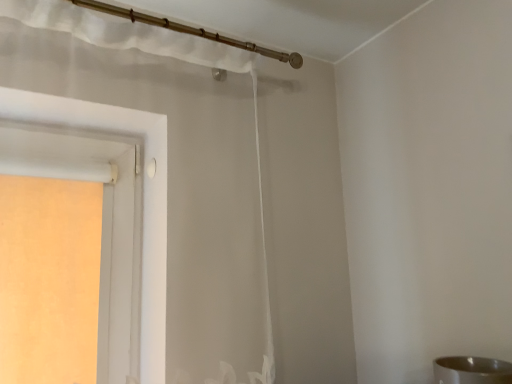
Locate an element on the screen. silver metallic sink at lower right is located at coordinates (471, 370).

The width and height of the screenshot is (512, 384). What do you see at coordinates (471, 370) in the screenshot? I see `silver metallic sink at lower right` at bounding box center [471, 370].

Find the location of a particular element. This screenshot has height=384, width=512. sheer white curtain at upper center is located at coordinates (140, 33).

The width and height of the screenshot is (512, 384). What do you see at coordinates (140, 33) in the screenshot? I see `sheer white curtain at upper center` at bounding box center [140, 33].

The width and height of the screenshot is (512, 384). I want to click on silver metallic sink at lower right, so click(x=471, y=370).

Can you confirm if silver metallic sink at lower right is positioned to the right of sheer white curtain at upper center?

Correct, you'll find silver metallic sink at lower right to the right of sheer white curtain at upper center.

Which object is closer to the camera taking this photo, silver metallic sink at lower right or sheer white curtain at upper center?

Positioned in front is silver metallic sink at lower right.

Considering the positions of points (452, 381) and (264, 47), is point (452, 381) farther from camera compared to point (264, 47)?

No.

From the image's perspective, is silver metallic sink at lower right beneath sheer white curtain at upper center?

Indeed, from the image's perspective, silver metallic sink at lower right is shown beneath sheer white curtain at upper center.

From a real-world perspective, is silver metallic sink at lower right physically above sheer white curtain at upper center?

No, from a real-world perspective, silver metallic sink at lower right is not on top of sheer white curtain at upper center.

Considering the sizes of objects silver metallic sink at lower right and sheer white curtain at upper center in the image provided, who is thinner, silver metallic sink at lower right or sheer white curtain at upper center?

Thinner between the two is silver metallic sink at lower right.

Considering the sizes of silver metallic sink at lower right and sheer white curtain at upper center in the image, is silver metallic sink at lower right taller or shorter than sheer white curtain at upper center?

Clearly, silver metallic sink at lower right is taller compared to sheer white curtain at upper center.

Based on the photo, which of these two, silver metallic sink at lower right or sheer white curtain at upper center, is smaller?

silver metallic sink at lower right.

Is silver metallic sink at lower right spatially inside sheer white curtain at upper center, or outside of it?

silver metallic sink at lower right is spatially situated outside sheer white curtain at upper center.

Is silver metallic sink at lower right far from sheer white curtain at upper center?

silver metallic sink at lower right is actually quite close to sheer white curtain at upper center.

Does silver metallic sink at lower right turn towards sheer white curtain at upper center?

No, silver metallic sink at lower right is not aimed at sheer white curtain at upper center.

The width and height of the screenshot is (512, 384). Find the location of `sink on the right side of sheer white curtain at upper center`. sink on the right side of sheer white curtain at upper center is located at coordinates (471, 370).

Is sheer white curtain at upper center to the left or to the right of silver metallic sink at lower right in the image?

Clearly, sheer white curtain at upper center is on the left of silver metallic sink at lower right in the image.

Is sheer white curtain at upper center further to camera compared to silver metallic sink at lower right?

Yes, sheer white curtain at upper center is further from the camera.

Does point (186, 43) come behind point (511, 368)?

Yes.

From the image's perspective, which one is positioned higher, sheer white curtain at upper center or silver metallic sink at lower right?

sheer white curtain at upper center is shown above in the image.

From a real-world perspective, is sheer white curtain at upper center physically below silver metallic sink at lower right?

Incorrect, from a real-world perspective, sheer white curtain at upper center is higher than silver metallic sink at lower right.

Based on the photo, which of these two, sheer white curtain at upper center or silver metallic sink at lower right, is wider?

sheer white curtain at upper center.

Does sheer white curtain at upper center have a greater height compared to silver metallic sink at lower right?

No.

Is sheer white curtain at upper center smaller than silver metallic sink at lower right?

Incorrect, sheer white curtain at upper center is not smaller in size than silver metallic sink at lower right.

In the scene shown: Do you think sheer white curtain at upper center is within silver metallic sink at lower right, or outside of it?

sheer white curtain at upper center is outside silver metallic sink at lower right.

Is sheer white curtain at upper center positioned far away from silver metallic sink at lower right?

sheer white curtain at upper center is actually quite close to silver metallic sink at lower right.

Could you tell me if sheer white curtain at upper center is facing silver metallic sink at lower right?

No, sheer white curtain at upper center does not turn towards silver metallic sink at lower right.

What's the angular difference between sheer white curtain at upper center and silver metallic sink at lower right's facing directions?

91.3 degrees separate the facing orientations of sheer white curtain at upper center and silver metallic sink at lower right.

The width and height of the screenshot is (512, 384). I want to click on curtain behind the silver metallic sink at lower right, so click(140, 33).

The image size is (512, 384). Identify the location of sink below the sheer white curtain at upper center (from a real-world perspective). (471, 370).

Locate an element on the screen. This screenshot has width=512, height=384. curtain on the left of the silver metallic sink at lower right is located at coordinates (140, 33).